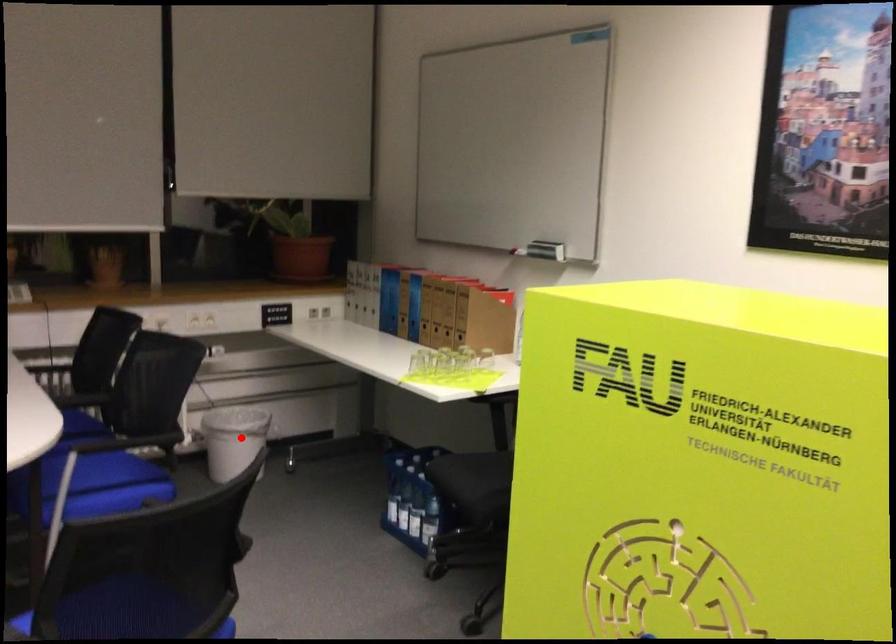
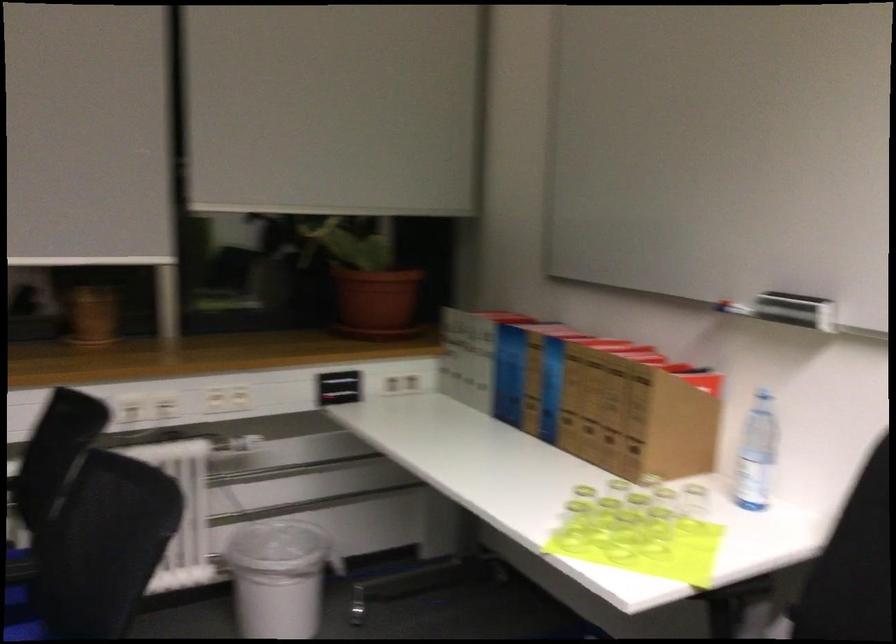
Where in the second image is the point corresponding to the highlighted location from the first image?

(278, 576)